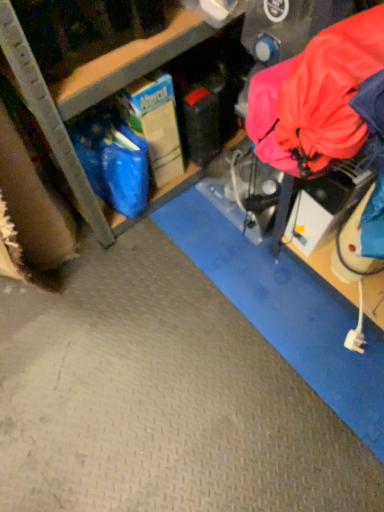
What do you see at coordinates (93, 73) in the screenshot?
I see `matte cardboard box at center` at bounding box center [93, 73].

Find the location of a particular element. matte cardboard box at center is located at coordinates (93, 73).

Identify the location of matte cardboard box at center. The height and width of the screenshot is (512, 384). (93, 73).